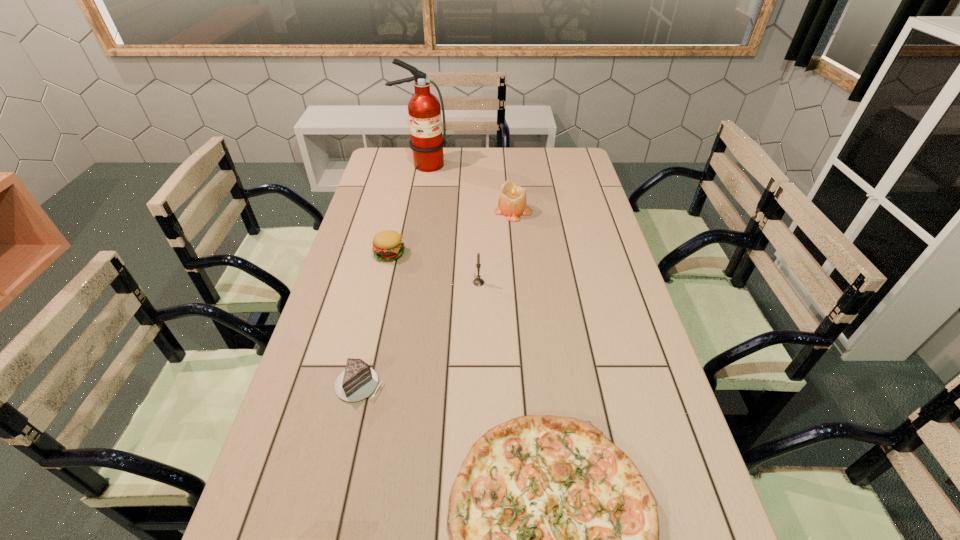
At what (x,y) coordinates should I click in order to perform the action: click on object that is the second closest one to the farthest object. Please return your answer as a coordinate pair (x, y). Looking at the image, I should click on (388, 245).